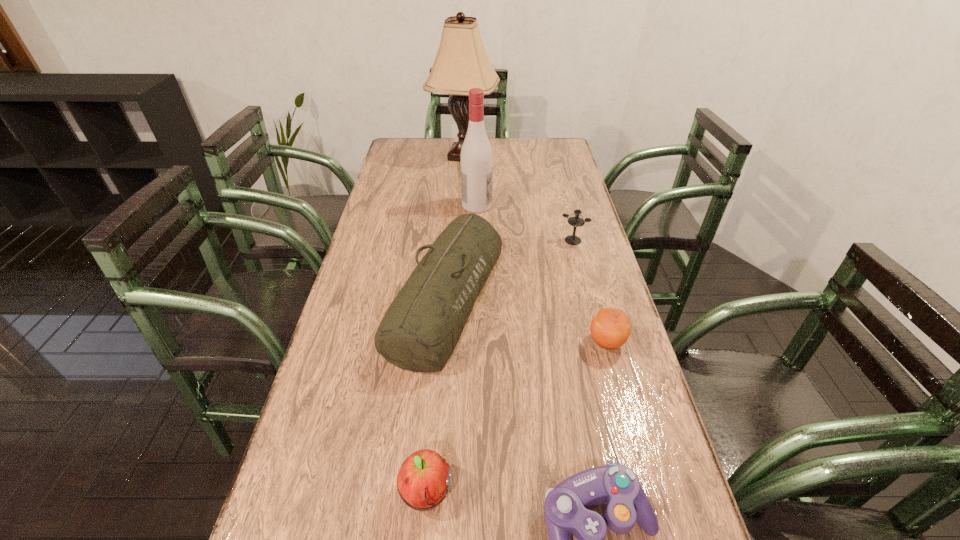
Find the location of `vacant area at the right edge of the desktop`. vacant area at the right edge of the desktop is located at coordinates (565, 227).

At what (x,y) coordinates should I click in order to perform the action: click on vacant space at the far left corner of the desktop. Please return your answer as a coordinate pair (x, y). Looking at the image, I should click on (406, 147).

This screenshot has width=960, height=540. What are the coordinates of `vacant space at the far right corner` in the screenshot? It's located at (538, 157).

Identify the location of vacant area that lies between the tallest object and the orange. The width and height of the screenshot is (960, 540). click(x=535, y=249).

Where is `free space between the orange and the apple`? This screenshot has height=540, width=960. free space between the orange and the apple is located at coordinates (516, 418).

This screenshot has height=540, width=960. What are the coordinates of `free spot between the apple and the orange` in the screenshot? It's located at (516, 418).

In order to click on free area in between the orange and the apple in this screenshot , I will do `click(516, 418)`.

Identify the location of object that is the third closest one to the candle holder. This screenshot has width=960, height=540. (610, 328).

Point out which object is positioned as the third nearest to the control. Please provide its 2D coordinates. Your answer should be formatted as a tuple, i.e. [(x, y)], where the tuple contains the x and y coordinates of a point satisfying the conditions above.

[(610, 328)]

Find the location of a particular element. Image resolution: width=960 pixels, height=540 pixels. vacant space that satisfies the following two spatial constraints: 1. on the front side of the candle holder; 2. on the right side of the orange is located at coordinates click(x=599, y=342).